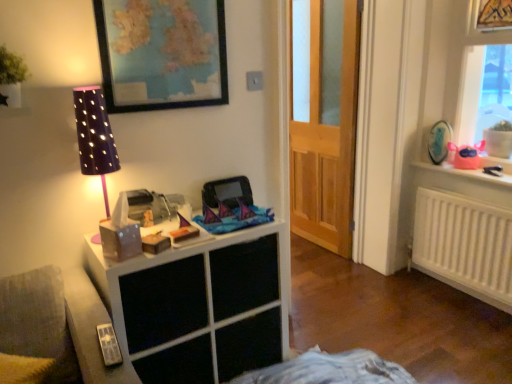
The height and width of the screenshot is (384, 512). Describe the element at coordinates (196, 307) in the screenshot. I see `white matte cabinet at left` at that location.

In order to face gold metallic picture frame at upper right, the third picture frame in the left-to-right sequence, should I rotate leftwards or rightwards?

It's best to rotate right around 30.472 degrees.

Describe the element at coordinates (439, 141) in the screenshot. The width and height of the screenshot is (512, 384). I see `matte blue picture frame at upper right, which is the 2th picture frame from right to left` at that location.

Measure the distance between point [470,35] and camera.

They are 2.52 meters apart.

Where is `wooden door at center`? The width and height of the screenshot is (512, 384). wooden door at center is located at coordinates pyautogui.click(x=326, y=126).

From a real-world perspective, does matte blue picture frame at upper right, arranged as the first picture frame when viewed from the back, sit lower than wooden door at center?

Yes.

Is matte blue picture frame at upper right, arranged as the first picture frame when viewed from the back, turned away from wooden door at center?

matte blue picture frame at upper right, arranged as the first picture frame when viewed from the back, does not have its back to wooden door at center.

Identify the location of door above the matte blue picture frame at upper right, arranged as the first picture frame when viewed from the back (from the image's perspective). (326, 126).

From a real-world perspective, is pink plastic toy at upper right located higher than white matte radiator at right?

Yes, from a real-world perspective, pink plastic toy at upper right is on top of white matte radiator at right.

Considering the relative positions of pink plastic toy at upper right and white matte radiator at right in the image provided, is pink plastic toy at upper right to the left of white matte radiator at right from the viewer's perspective?

In fact, pink plastic toy at upper right is to the right of white matte radiator at right.

Which is closer to the camera, (x=464, y=165) or (x=456, y=250)?

Point (x=464, y=165) appears to be closer to the viewer than point (x=456, y=250).

Is white matte radiator at right at the back of pink plastic toy at upper right?

No, pink plastic toy at upper right is not facing the opposite direction of white matte radiator at right.

Where is `window sill on the right side of white matte cabinet at left`? The height and width of the screenshot is (384, 512). window sill on the right side of white matte cabinet at left is located at coordinates (475, 170).

Is point (424, 167) closer to camera compared to point (154, 361)?

No.

Measure the distance between pink plastic bag at upper right and white matte cabinet at left.

pink plastic bag at upper right and white matte cabinet at left are 5.62 feet apart from each other.

Is pink plastic bag at upper right facing towards white matte cabinet at left?

Yes, pink plastic bag at upper right is aimed at white matte cabinet at left.

In the image, is gold metallic picture frame at upper right, the third picture frame in the left-to-right sequence, positioned in front of or behind matte blue picture frame at upper right, arranged as the first picture frame when viewed from the back?

Visually, gold metallic picture frame at upper right, the third picture frame in the left-to-right sequence, is located in front of matte blue picture frame at upper right, arranged as the first picture frame when viewed from the back.

From the picture: Which of these two, gold metallic picture frame at upper right, the third picture frame in the left-to-right sequence, or matte blue picture frame at upper right, the 3th picture frame in the top-to-bottom sequence, is thinner?

gold metallic picture frame at upper right, the third picture frame in the left-to-right sequence, is thinner.

Between gold metallic picture frame at upper right, the third picture frame in the left-to-right sequence, and matte blue picture frame at upper right, which is the 2th picture frame from right to left, which one has smaller size?

gold metallic picture frame at upper right, the third picture frame in the left-to-right sequence.

How many degrees apart are the facing directions of gold metallic picture frame at upper right, acting as the 3th picture frame starting from the bottom, and white matte radiator at right?

179 degrees.

Measure the distance between gold metallic picture frame at upper right, arranged as the 2th picture frame when viewed from the front, and white matte radiator at right.

gold metallic picture frame at upper right, arranged as the 2th picture frame when viewed from the front, is 1.23 meters away from white matte radiator at right.

From the image's perspective, is gold metallic picture frame at upper right, which is the 1th picture frame from right to left, under white matte radiator at right?

No.

Is point (498, 21) positioned behind point (421, 244)?

No, it is not.

Would you say pink plastic bag at upper right is a long distance from gold metallic picture frame at upper right, the third picture frame in the left-to-right sequence?

No, pink plastic bag at upper right is not far away from gold metallic picture frame at upper right, the third picture frame in the left-to-right sequence.

Considering the sizes of pink plastic bag at upper right and gold metallic picture frame at upper right, the third picture frame in the left-to-right sequence, in the image, is pink plastic bag at upper right bigger or smaller than gold metallic picture frame at upper right, the third picture frame in the left-to-right sequence,?

In the image, pink plastic bag at upper right appears to be smaller than gold metallic picture frame at upper right, the third picture frame in the left-to-right sequence.

In the scene shown: Is pink plastic bag at upper right not inside gold metallic picture frame at upper right, which is the 1th picture frame from right to left?

Yes.

Based on the photo, between pink plastic bag at upper right and gold metallic picture frame at upper right, placed as the first picture frame when sorted from top to bottom, which one has more height?

With more height is gold metallic picture frame at upper right, placed as the first picture frame when sorted from top to bottom.

From the image's perspective, which one is positioned higher, purple dotted fabric at left or pink plastic bag at upper right?

pink plastic bag at upper right, from the image's perspective.

Is purple dotted fabric at left looking in the opposite direction of pink plastic bag at upper right?

No.

Would you say purple dotted fabric at left is outside pink plastic bag at upper right?

Yes, purple dotted fabric at left is located beyond the bounds of pink plastic bag at upper right.

Does point (116, 153) come closer to viewer compared to point (490, 176)?

That is True.

The height and width of the screenshot is (384, 512). What are the coordinates of `door on the left of matte blue picture frame at upper right, the 3th picture frame in the top-to-bottom sequence` in the screenshot? It's located at (326, 126).

Locate an element on the screen. toy on the right of white matte radiator at right is located at coordinates (466, 155).

Estimate the real-world distances between objects in this image. Which object is closer to purple dotted fabric at left, wooden framed map at upper center, placed as the third picture frame when sorted from back to front, or white matte cabinet at left?

Based on the image, wooden framed map at upper center, placed as the third picture frame when sorted from back to front, appears to be nearer to purple dotted fabric at left.

Looking at the image, which one is located further to pink plastic toy at upper right, pink plastic toy at upper right or wooden framed map at upper center, the 2th picture frame viewed from the top?

wooden framed map at upper center, the 2th picture frame viewed from the top, is further to pink plastic toy at upper right.

From the picture: Which object lies further to the anchor point gold metallic picture frame at upper right, arranged as the 2th picture frame when viewed from the front, matte blue picture frame at upper right, acting as the third picture frame starting from the front, or pink plastic toy at upper right?

The object further to gold metallic picture frame at upper right, arranged as the 2th picture frame when viewed from the front, is matte blue picture frame at upper right, acting as the third picture frame starting from the front.

When comparing their distances from pink plastic bag at upper right, does wooden door at center or pink plastic toy at upper right seem further?

wooden door at center is positioned further to the anchor pink plastic bag at upper right.

From the image, which object appears to be nearer to purple dotted fabric at left, gold metallic picture frame at upper right, the third picture frame in the left-to-right sequence, or pink plastic toy at upper right?

Based on the image, pink plastic toy at upper right appears to be nearer to purple dotted fabric at left.

Looking at the image, which one is located closer to wooden framed map at upper center, the 2th picture frame viewed from the top, white matte radiator at right or pink plastic bag at upper right?

Among the two, white matte radiator at right is located nearer to wooden framed map at upper center, the 2th picture frame viewed from the top.

Considering their positions, is white matte radiator at right positioned further to pink plastic bag at upper right than pink plastic toy at upper right?

white matte radiator at right lies further to pink plastic bag at upper right than the other object.

When comparing their distances from pink plastic toy at upper right, does pink plastic bag at upper right or gold metallic picture frame at upper right, positioned as the second picture frame in back-to-front order, seem closer?

gold metallic picture frame at upper right, positioned as the second picture frame in back-to-front order.

You are a GUI agent. You are given a task and a screenshot of the screen. Output one action in this format:
    pyautogui.click(x=<x>, y=<y>)
    Task: Click on the toy between wooden door at center and pink plastic toy at upper right
    The height and width of the screenshot is (384, 512).
    Given the screenshot: What is the action you would take?
    pyautogui.click(x=466, y=155)

Where is `cabinetry between wooden framed map at upper center, the first picture frame viewed from the front, and gold metallic picture frame at upper right, acting as the 3th picture frame starting from the bottom`? The height and width of the screenshot is (384, 512). cabinetry between wooden framed map at upper center, the first picture frame viewed from the front, and gold metallic picture frame at upper right, acting as the 3th picture frame starting from the bottom is located at coordinates (196, 307).

Locate an element on the screen. picture frame situated between white matte cabinet at left and pink plastic toy at upper right from left to right is located at coordinates (439, 141).

Where is `table lamp positioned between white matte cabinet at left and wooden door at center from near to far`? This screenshot has height=384, width=512. table lamp positioned between white matte cabinet at left and wooden door at center from near to far is located at coordinates (95, 137).